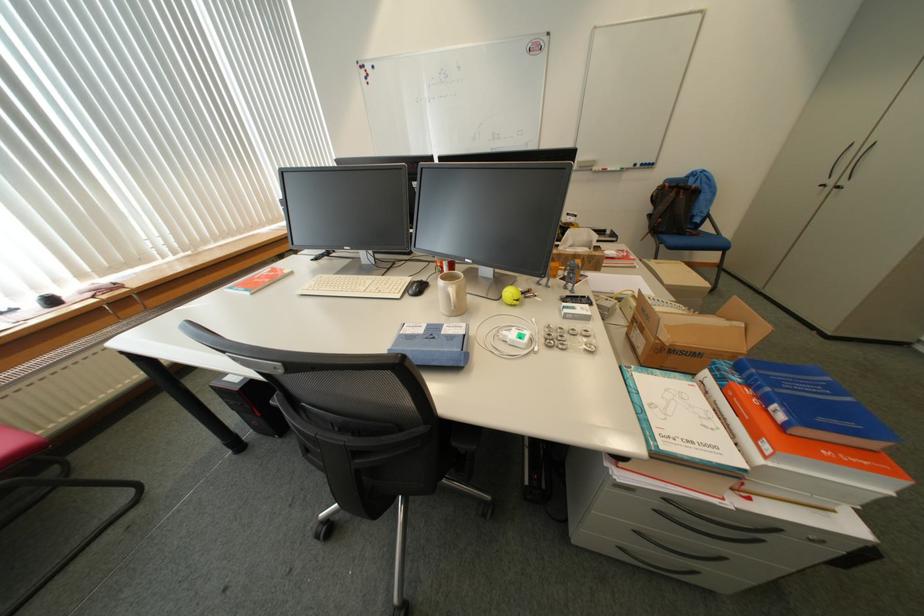
Which object does [511,294] point to?

This point indicates the yellow tennis ball.